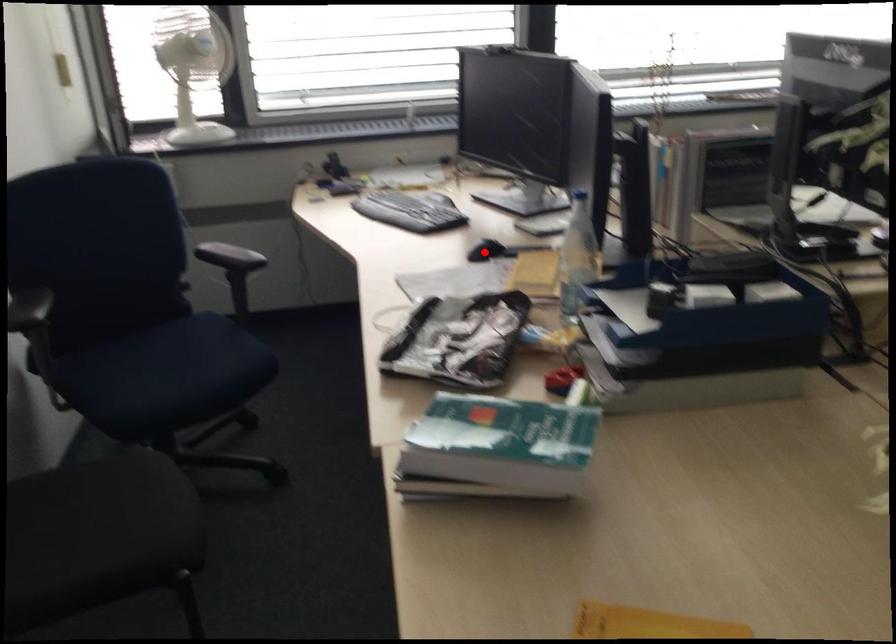
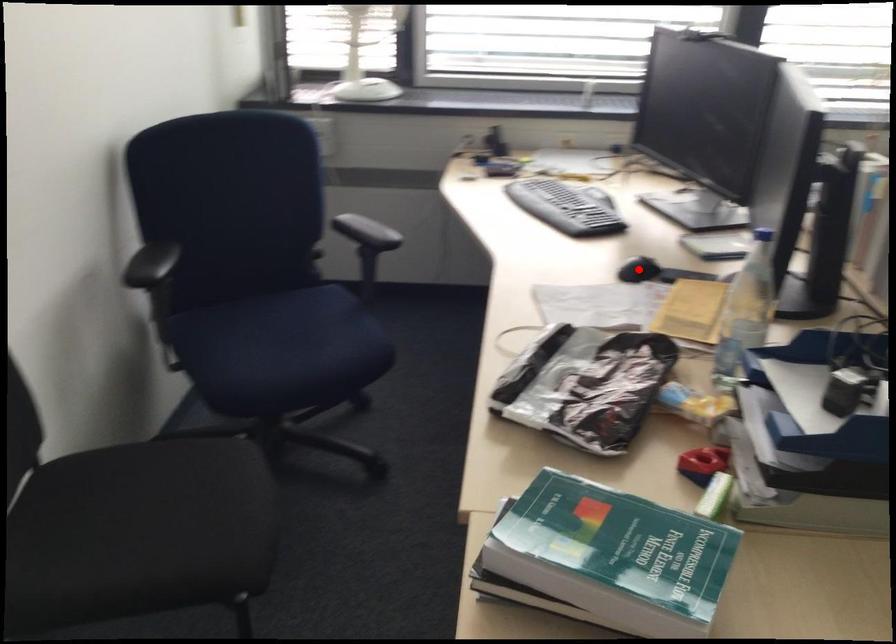
I am providing you with two images of the same scene from different viewpoints. A red point is marked on the first image and another point is marked on the second image. Are the points marked in image1 and image2 representing the same 3D position?

Yes